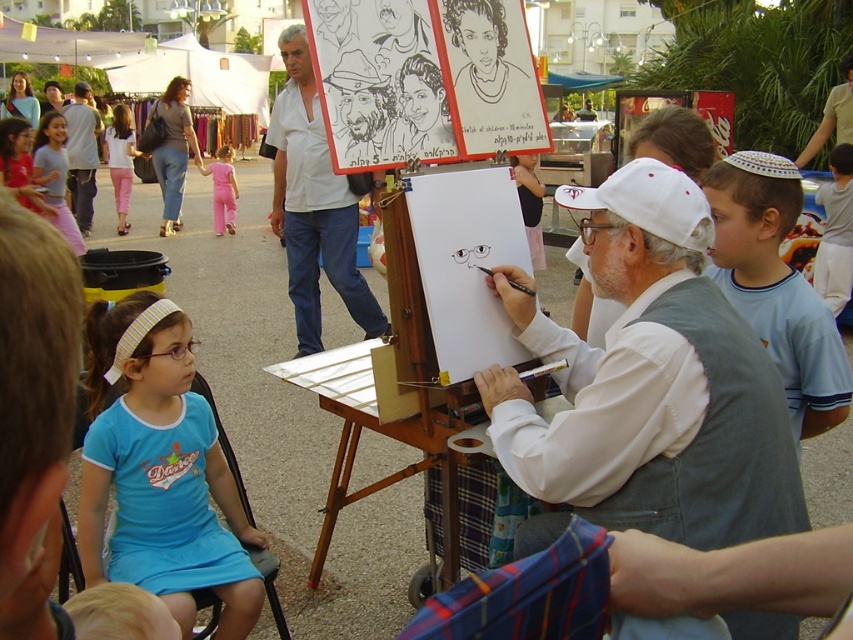
Question: Which object appears closest to the camera in this image?

Choices:
 (A) wooden easel at center
 (B) white cotton shirt at upper right

Answer: (A)

Question: Which object appears closest to the camera in this image?

Choices:
 (A) matte white shirt at upper center
 (B) blue fabric dress at lower left
 (C) wooden easel at center

Answer: (B)

Question: Which object is farther from the camera taking this photo?

Choices:
 (A) white shirt at center
 (B) pink fabric pants at lower left
 (C) white cotton shirt at upper right
 (D) blue fabric dress at lower left

Answer: (B)

Question: Is white fabric vest at center positioned before pink fabric pants at lower left?

Choices:
 (A) no
 (B) yes

Answer: (B)

Question: Observing the image, what is the correct spatial positioning of light blue t-shirt at right in reference to white cotton shirt at upper right?

Choices:
 (A) right
 (B) left

Answer: (B)

Question: Does white fabric vest at center have a greater width compared to white shirt at center?

Choices:
 (A) no
 (B) yes

Answer: (A)